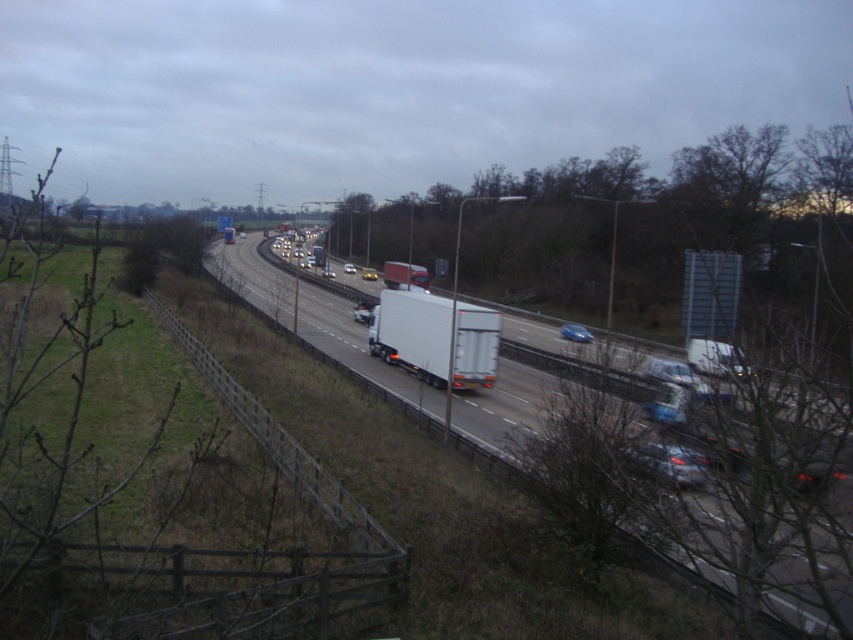
You are a driver trying to navigate the highway. You see two points on the road ahead, point 1 at coordinates (579, 340) and point 2 at (364, 273). Which point is closer to your current position?

Point 1 at coordinates (579, 340) is closer to your current position because it is closer to the viewer than point 2 at (364, 273).

In the scene shown: You are a driver approaching the white glossy truck at center and the blue metallic sedan at center on a multi lane highway. Which vehicle should you maintain a greater distance behind to ensure safety?

You should maintain a greater distance behind the white glossy truck at center because it is larger in size compared to the blue metallic sedan at center, requiring more braking distance for safety.